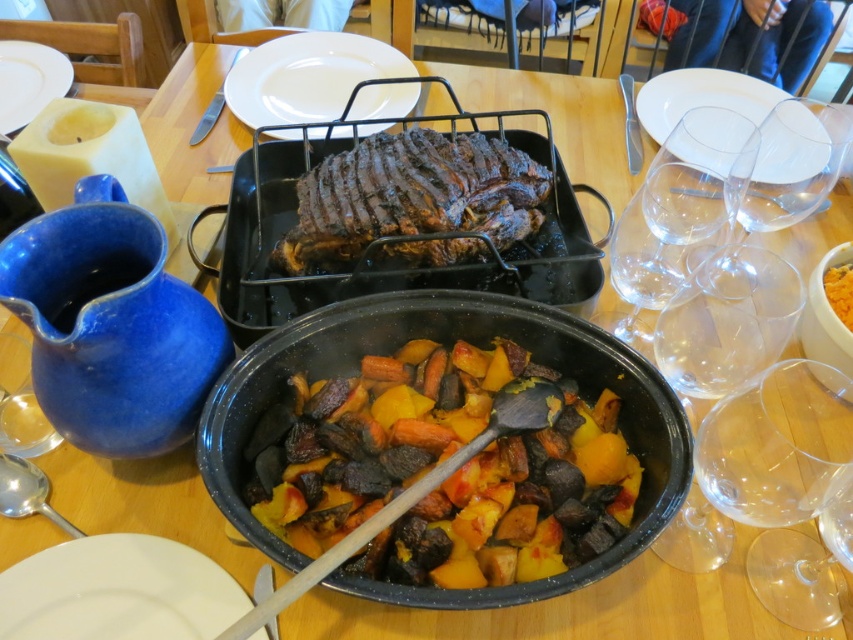
Does transparent glass wine glass at upper right appear under white ceramic plate at upper right?

Indeed, transparent glass wine glass at upper right is positioned under white ceramic plate at upper right.

Is point (804, 186) less distant than point (662, 96)?

That is True.

The image size is (853, 640). I want to click on transparent glass wine glass at upper right, so click(793, 163).

Does orange-brown glazed meat at center have a lesser width compared to white ceramic plate at center?

No.

Who is shorter, orange-brown glazed meat at center or white ceramic plate at center?

Standing shorter between the two is orange-brown glazed meat at center.

This screenshot has height=640, width=853. I want to click on orange-brown glazed meat at center, so click(451, 474).

You are a GUI agent. You are given a task and a screenshot of the screen. Output one action in this format:
    pyautogui.click(x=<x>, y=<y>)
    Task: Click on the orange-brown glazed meat at center
    
    Given the screenshot: What is the action you would take?
    pyautogui.click(x=451, y=474)

Is point (22, 470) less distant than point (840, 323)?

Yes, point (22, 470) is in front of point (840, 323).

Looking at this image, who is lower down, spoon at lower left or yellow-orange textured bread at upper right?

spoon at lower left is below.

The width and height of the screenshot is (853, 640). What are the coordinates of `spoon at lower left` in the screenshot? It's located at (27, 492).

You are a GUI agent. You are given a task and a screenshot of the screen. Output one action in this format:
    pyautogui.click(x=<x>, y=<y>)
    Task: Click on the spoon at lower left
    
    Given the screenshot: What is the action you would take?
    pyautogui.click(x=27, y=492)